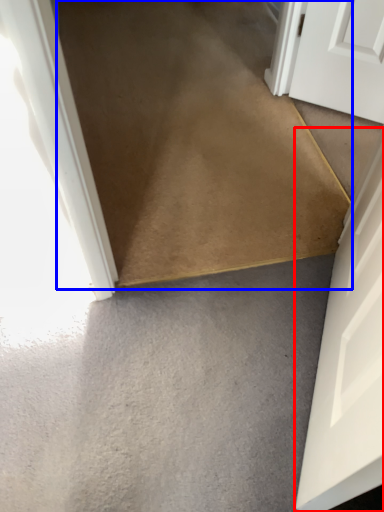
Question: Which point is closer to the camera, door (highlighted by a red box) or path (highlighted by a blue box)?

Choices:
 (A) door
 (B) path

Answer: (A)